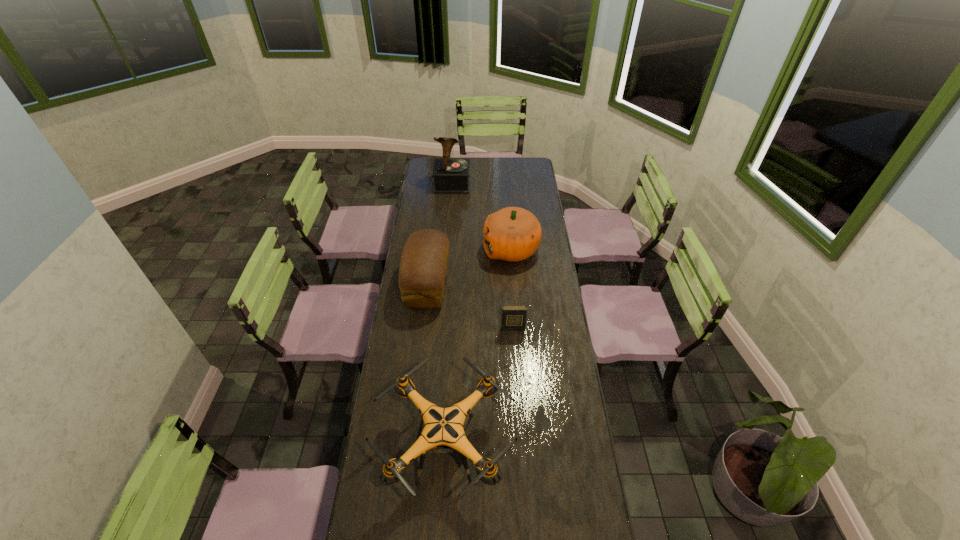
Locate an element on the screen. This screenshot has width=960, height=540. vacant area situated on the face of the pumpkin is located at coordinates (426, 250).

Image resolution: width=960 pixels, height=540 pixels. I want to click on free space located on the back of the bread, so click(x=435, y=221).

Image resolution: width=960 pixels, height=540 pixels. Find the location of `vacant area situated 0.100m on the camera mount of the drone`. vacant area situated 0.100m on the camera mount of the drone is located at coordinates (542, 448).

I want to click on blank space located on the front cover of the shortest object, so click(518, 413).

Find the location of a particular element. The image size is (960, 540). object located at the far edge is located at coordinates (451, 176).

Find the location of a particular element. phonograph_record positioned at the left edge is located at coordinates (451, 176).

This screenshot has height=540, width=960. In order to click on bread at the left edge in this screenshot , I will do `click(422, 271)`.

In order to click on drone that is at the left edge in this screenshot , I will do [x=443, y=429].

The width and height of the screenshot is (960, 540). I want to click on object located in the right edge section of the desktop, so click(x=512, y=234).

Where is `object positioned at the far left corner`? The width and height of the screenshot is (960, 540). object positioned at the far left corner is located at coordinates (451, 176).